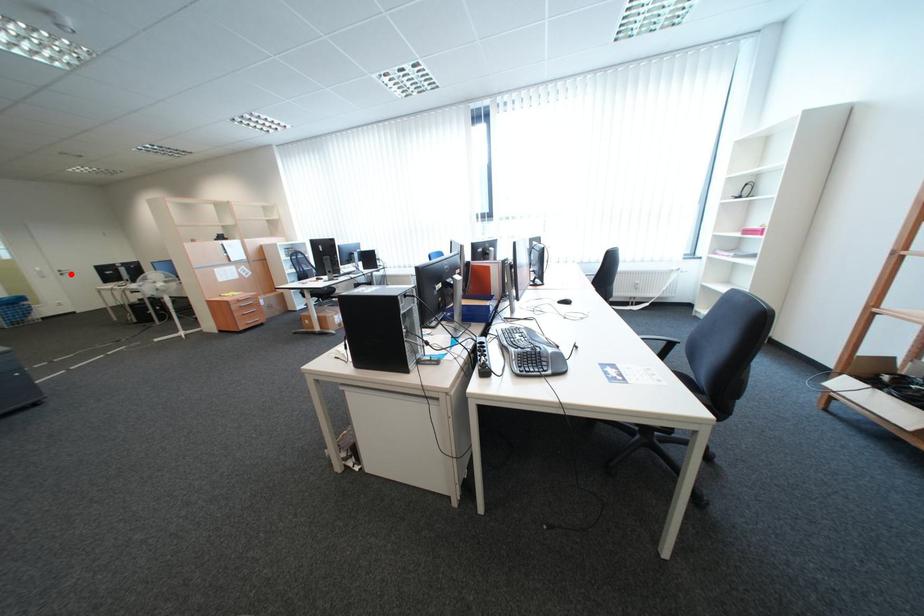
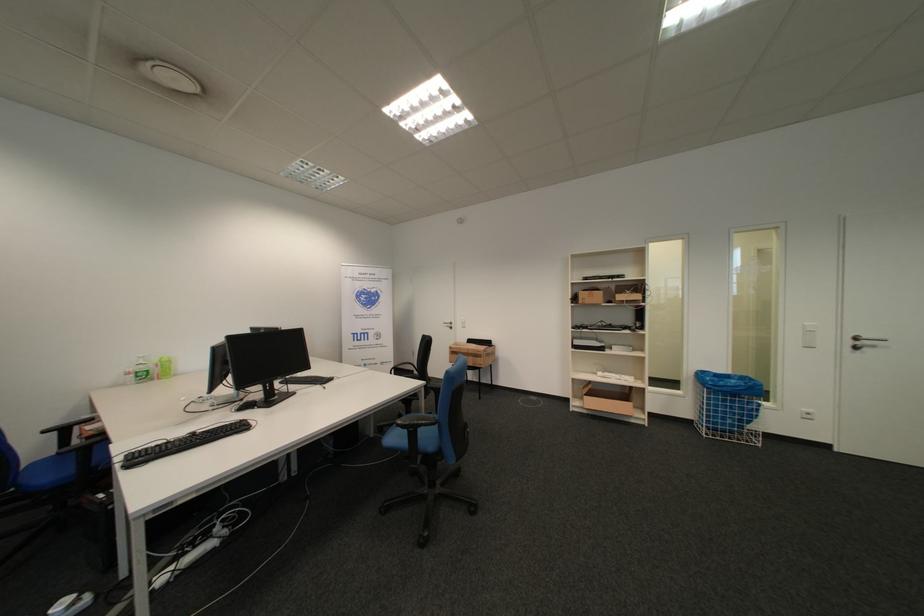
In the second image, find the point that corresponds to the highlighted location in the first image.

(862, 344)